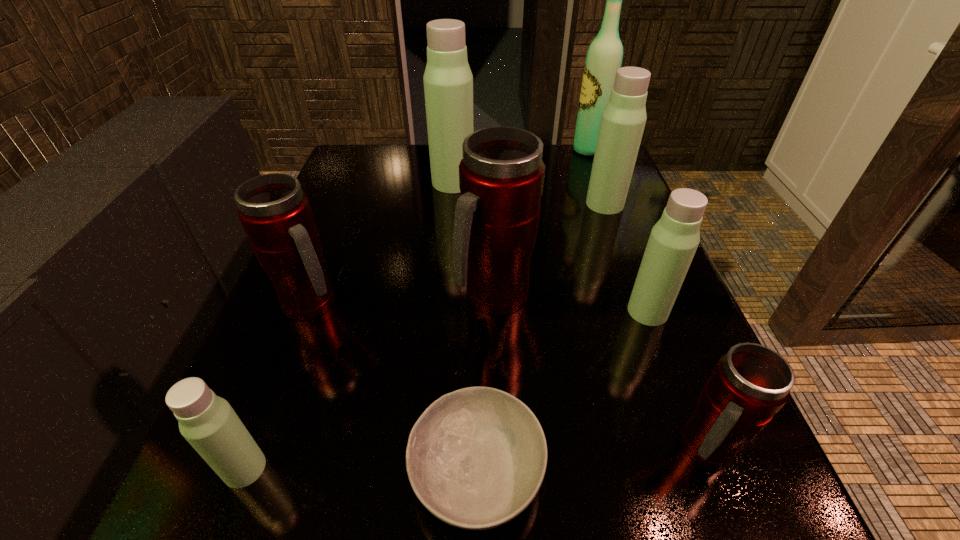
This screenshot has width=960, height=540. In order to click on the farthest object in this screenshot , I will do `click(604, 57)`.

You are a GUI agent. You are given a task and a screenshot of the screen. Output one action in this format:
    pyautogui.click(x=<x>, y=<y>)
    Task: Click on the wine bottle
    Image resolution: width=960 pixels, height=540 pixels.
    Given the screenshot: What is the action you would take?
    pyautogui.click(x=604, y=57)

You are a GUI agent. You are given a task and a screenshot of the screen. Output one action in this format:
    pyautogui.click(x=<x>, y=<y>)
    Task: Click on the third light thermos bottle from right to left
    The height and width of the screenshot is (540, 960).
    Given the screenshot: What is the action you would take?
    pyautogui.click(x=448, y=81)

Identify the location of the farthest light thermos bottle. (448, 81).

At what (x,y) coordinates should I click in order to perform the action: click on the third smallest light thermos bottle. Please return your answer as a coordinate pair (x, y). Looking at the image, I should click on (623, 120).

Locate an element on the screen. the second farthest light thermos bottle is located at coordinates (623, 120).

Locate an element on the screen. the second red thermos bottle from left to right is located at coordinates (501, 176).

The width and height of the screenshot is (960, 540). Find the location of `the leftmost red thermos bottle`. the leftmost red thermos bottle is located at coordinates (275, 213).

Where is `the third farthest light thermos bottle`? This screenshot has width=960, height=540. the third farthest light thermos bottle is located at coordinates (673, 241).

Where is `the rightmost red thermos bottle`? This screenshot has height=540, width=960. the rightmost red thermos bottle is located at coordinates (751, 383).